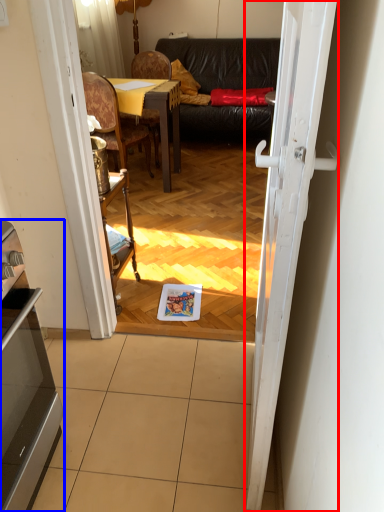
Question: Which point is further to the camera, door (highlighted by a red box) or appliance (highlighted by a blue box)?

Choices:
 (A) door
 (B) appliance

Answer: (B)